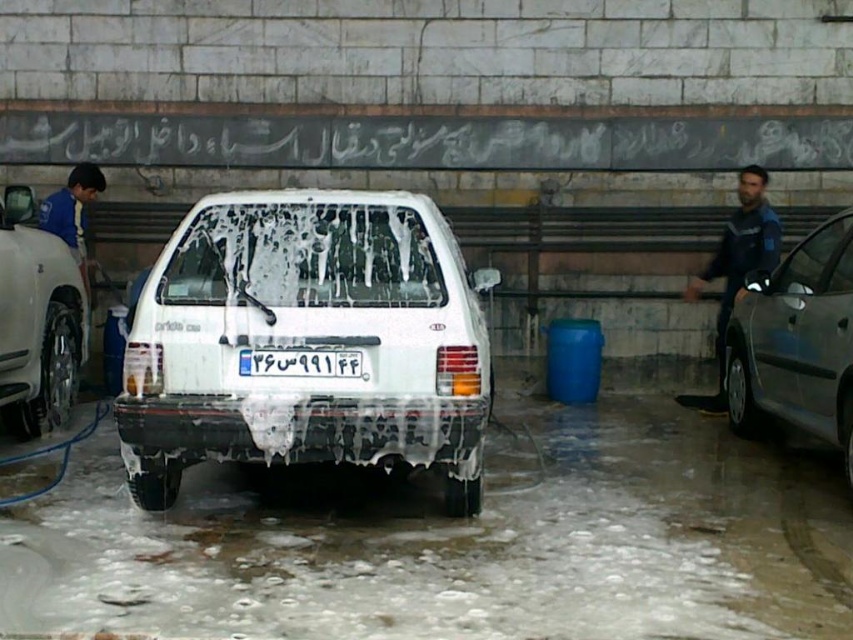
You are a car wash attendant and need to clean the license plate. Given that the white plastic license plate at center is behind the white matte car at left, which direction should you move the car to access it?

Since the white plastic license plate at center is behind the white matte car at left, you should move the car forward to access the license plate.

Based on the photo, you are standing in front of the car wash scene. There are two points marked on the image, one at coordinates point (x=808, y=300) and another at point (x=6, y=196). Which point is nearer to you?

Point (x=808, y=300) is closer to the viewer than point (x=6, y=196).

In the scene shown: You are a car wash attendant and need to clean the blue denim jeans at right and the white plastic license plate at center. Which object is located higher up on the car?

The blue denim jeans at right is positioned over the white plastic license plate at center, so it is higher up on the car.